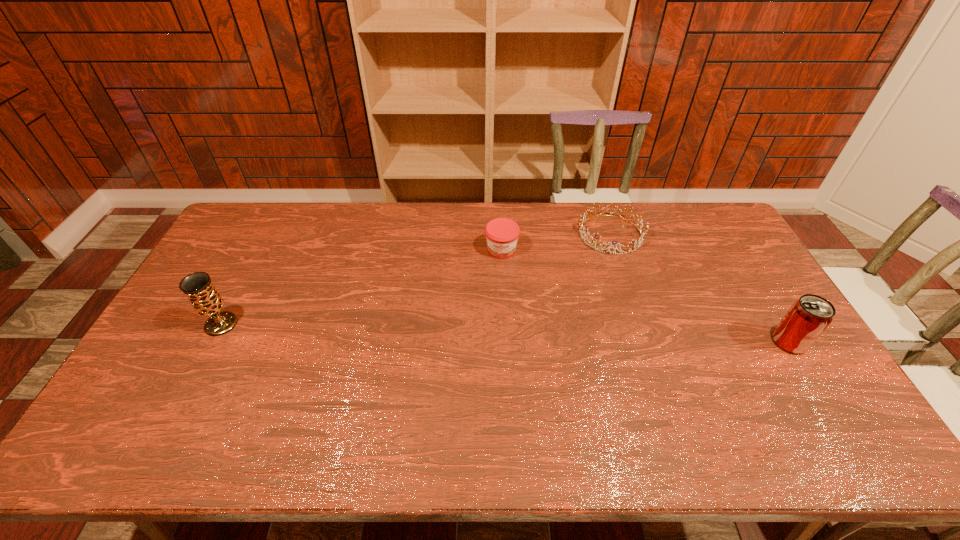
This screenshot has width=960, height=540. In order to click on the leftmost object in this screenshot , I will do `click(205, 299)`.

You are a GUI agent. You are given a task and a screenshot of the screen. Output one action in this format:
    pyautogui.click(x=<x>, y=<y>)
    Task: Click on the pop soda
    This screenshot has height=540, width=960.
    Given the screenshot: What is the action you would take?
    pyautogui.click(x=808, y=317)

Locate an element on the screen. The image size is (960, 540). the third shortest object is located at coordinates (808, 317).

The height and width of the screenshot is (540, 960). What are the coordinates of `the third object from right to left` in the screenshot? It's located at (502, 234).

The image size is (960, 540). I want to click on jam, so click(502, 234).

Locate an element on the screen. The image size is (960, 540). the shortest object is located at coordinates (596, 236).

Find the location of a particular element. the second object from right to left is located at coordinates (x=596, y=236).

I want to click on vacant space situated 0.050m on the back of the chalice, so click(234, 300).

Where is `vacant area located on the left of the pop soda`? The height and width of the screenshot is (540, 960). vacant area located on the left of the pop soda is located at coordinates (731, 342).

Where is `free space located 0.230m on the label side of the jam`? free space located 0.230m on the label side of the jam is located at coordinates (500, 313).